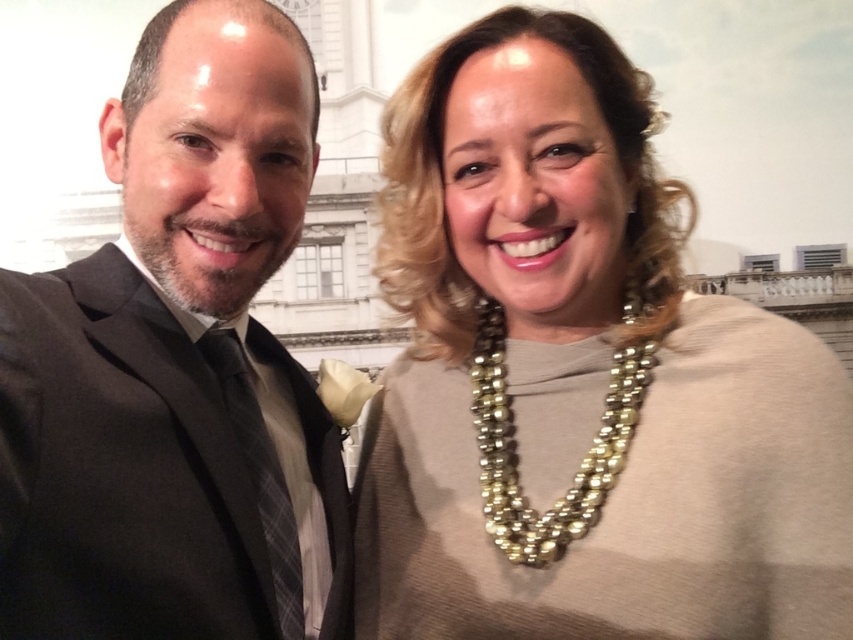
Can you confirm if matte gold necklace at center is thinner than pearl-like beads necklace at upper center?

No, matte gold necklace at center is not thinner than pearl-like beads necklace at upper center.

Is point (631, 266) in front of point (639, 360)?

No, it is not.

Find the location of a particular element. This screenshot has height=640, width=853. matte gold necklace at center is located at coordinates (579, 378).

Does point (6, 595) come in front of point (648, 368)?

Yes, it is.

Does black satin suit at left appear over pearl-like beads necklace at upper center?

Yes.

Who is more forward, (216, 204) or (483, 476)?

Point (216, 204) is in front.

Where is `black satin suit at left`? The width and height of the screenshot is (853, 640). black satin suit at left is located at coordinates (177, 368).

This screenshot has width=853, height=640. What do you see at coordinates (579, 378) in the screenshot? I see `matte gold necklace at center` at bounding box center [579, 378].

Does matte gold necklace at center have a greater height compared to black satin suit at left?

Indeed, matte gold necklace at center has a greater height compared to black satin suit at left.

The width and height of the screenshot is (853, 640). Describe the element at coordinates (579, 378) in the screenshot. I see `matte gold necklace at center` at that location.

Identify the location of matte gold necklace at center. The image size is (853, 640). [x=579, y=378].